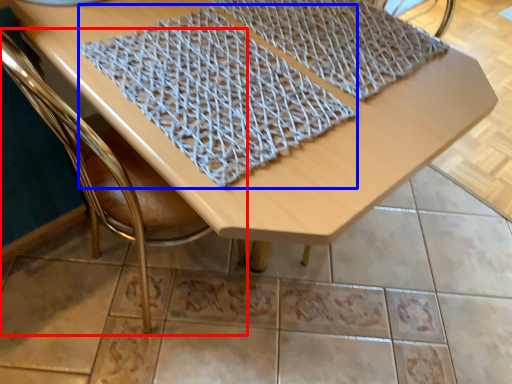
Question: Among these objects, which one is nearest to the camera, chair (highlighted by a red box) or blanket (highlighted by a blue box)?

Choices:
 (A) chair
 (B) blanket

Answer: (A)